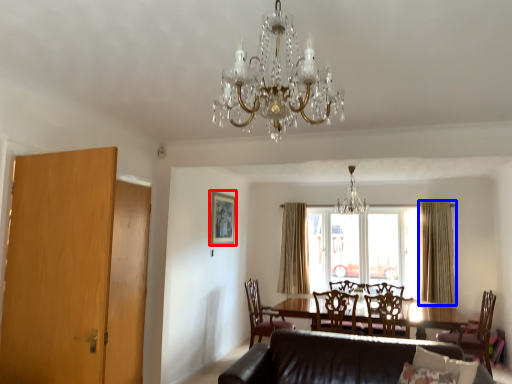
Question: Which object appears farthest to the camera in this image, picture frame (highlighted by a red box) or curtain (highlighted by a blue box)?

Choices:
 (A) picture frame
 (B) curtain

Answer: (B)